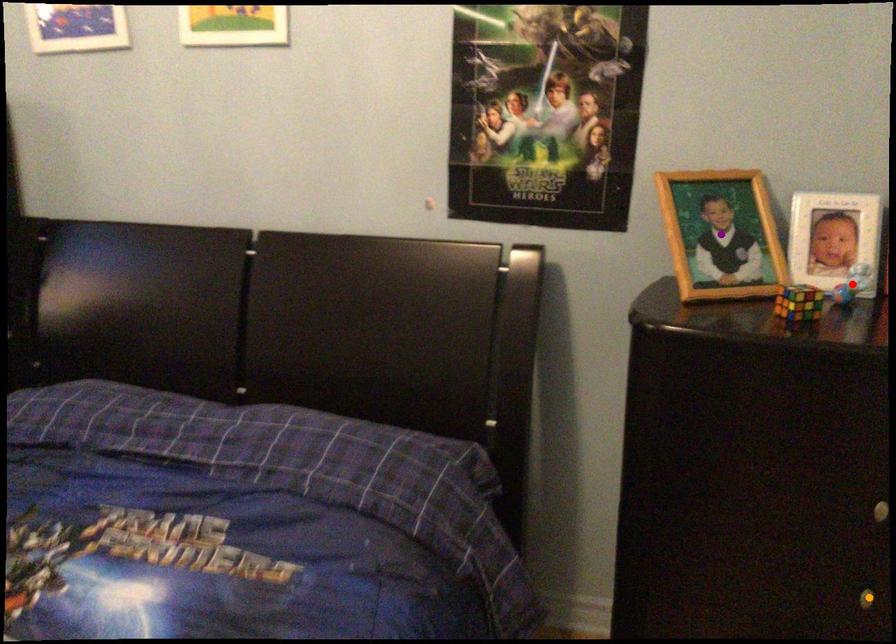
Order these from nearest to farthest:
A) orange point
B) red point
C) purple point

orange point
red point
purple point